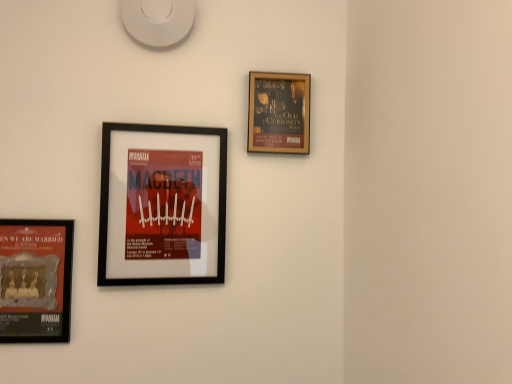
Image resolution: width=512 pixels, height=384 pixels. Describe the element at coordinates (35, 280) in the screenshot. I see `matte black poster at lower left, which is counted as the third picture frame, starting from the right` at that location.

Where is `black matte picture frame at center-left, placed as the second picture frame when sorted from left to right`? This screenshot has height=384, width=512. black matte picture frame at center-left, placed as the second picture frame when sorted from left to right is located at coordinates point(162,205).

From a real-world perspective, which object rests below the other?

In real-world perspective, matte black poster at lower left, which is the first picture frame from left to right, is lower.

Is black matte picture frame at center-left, placed as the second picture frame when sorted from left to right, positioned far away from matte black poster at lower left, which is counted as the third picture frame, starting from the right?

black matte picture frame at center-left, placed as the second picture frame when sorted from left to right, is actually quite close to matte black poster at lower left, which is counted as the third picture frame, starting from the right.

Is black matte picture frame at center-left, which is the 2th picture frame in right-to-left order, shorter than matte black poster at lower left, which is the first picture frame from left to right?

Incorrect, the height of black matte picture frame at center-left, which is the 2th picture frame in right-to-left order, does not fall short of that of matte black poster at lower left, which is the first picture frame from left to right.

Is gold-framed poster at upper right, which appears as the third picture frame when viewed from the left, turned away from matte black poster at lower left, which is the first picture frame from left to right?

gold-framed poster at upper right, which appears as the third picture frame when viewed from the left, is not turned away from matte black poster at lower left, which is the first picture frame from left to right.

Where is `picture frame that is the 2nd one when counting upward from the matte black poster at lower left, which is counted as the third picture frame, starting from the right (from the image's perspective)`? The width and height of the screenshot is (512, 384). picture frame that is the 2nd one when counting upward from the matte black poster at lower left, which is counted as the third picture frame, starting from the right (from the image's perspective) is located at coordinates (279, 113).

Which point is more forward, (283, 118) or (54, 275)?

The point (54, 275) is closer to the camera.

Is gold-framed poster at upper right, which appears as the third picture frame when viewed from the left, to the right of matte black poster at lower left, which is the first picture frame from left to right, from the viewer's perspective?

Indeed, gold-framed poster at upper right, which appears as the third picture frame when viewed from the left, is positioned on the right side of matte black poster at lower left, which is the first picture frame from left to right.

Can we say matte black poster at lower left, which is counted as the third picture frame, starting from the right, lies outside gold-framed poster at upper right, which appears as the first picture frame when viewed from the right?

Yes, matte black poster at lower left, which is counted as the third picture frame, starting from the right, is located beyond the bounds of gold-framed poster at upper right, which appears as the first picture frame when viewed from the right.

Which of these two, matte black poster at lower left, which is the first picture frame from left to right, or gold-framed poster at upper right, which appears as the third picture frame when viewed from the left, is thinner?

matte black poster at lower left, which is the first picture frame from left to right, is thinner.

Is matte black poster at lower left, which is counted as the third picture frame, starting from the right, positioned with its back to gold-framed poster at upper right, which appears as the third picture frame when viewed from the left?

matte black poster at lower left, which is counted as the third picture frame, starting from the right, is not turned away from gold-framed poster at upper right, which appears as the third picture frame when viewed from the left.

From the picture: Would you say matte black poster at lower left, which is counted as the third picture frame, starting from the right, is a long distance from gold-framed poster at upper right, which appears as the first picture frame when viewed from the right?

No, matte black poster at lower left, which is counted as the third picture frame, starting from the right, is in close proximity to gold-framed poster at upper right, which appears as the first picture frame when viewed from the right.

Is black matte picture frame at center-left, placed as the second picture frame when sorted from left to right, a part of matte black poster at lower left, which is the first picture frame from left to right?

No, black matte picture frame at center-left, placed as the second picture frame when sorted from left to right, is not a part of matte black poster at lower left, which is the first picture frame from left to right.

Based on the photo, from the image's perspective, which one is positioned lower, matte black poster at lower left, which is counted as the third picture frame, starting from the right, or black matte picture frame at center-left, which is the 2th picture frame in right-to-left order?

matte black poster at lower left, which is counted as the third picture frame, starting from the right, appears lower in the image.

The image size is (512, 384). In order to click on picture frame that is the 1st object to the right of the matte black poster at lower left, which is counted as the third picture frame, starting from the right, starting at the anchor in this screenshot , I will do `click(162, 205)`.

Is matte black poster at lower left, which is the first picture frame from left to right, facing away from black matte picture frame at center-left, placed as the second picture frame when sorted from left to right?

No, matte black poster at lower left, which is the first picture frame from left to right, is not facing away from black matte picture frame at center-left, placed as the second picture frame when sorted from left to right.

Is gold-framed poster at upper right, which appears as the first picture frame when viewed from the right, positioned before black matte picture frame at center-left, placed as the second picture frame when sorted from left to right?

No, gold-framed poster at upper right, which appears as the first picture frame when viewed from the right, is behind black matte picture frame at center-left, placed as the second picture frame when sorted from left to right.

From a real-world perspective, does gold-framed poster at upper right, which appears as the third picture frame when viewed from the left, sit lower than black matte picture frame at center-left, which is the 2th picture frame in right-to-left order?

Incorrect, from a real-world perspective, gold-framed poster at upper right, which appears as the third picture frame when viewed from the left, is higher than black matte picture frame at center-left, which is the 2th picture frame in right-to-left order.

Can you confirm if gold-framed poster at upper right, which appears as the third picture frame when viewed from the left, is bigger than black matte picture frame at center-left, placed as the second picture frame when sorted from left to right?

Actually, gold-framed poster at upper right, which appears as the third picture frame when viewed from the left, might be smaller than black matte picture frame at center-left, placed as the second picture frame when sorted from left to right.

Does gold-framed poster at upper right, which appears as the third picture frame when viewed from the left, turn towards black matte picture frame at center-left, placed as the second picture frame when sorted from left to right?

No, gold-framed poster at upper right, which appears as the third picture frame when viewed from the left, is not oriented towards black matte picture frame at center-left, placed as the second picture frame when sorted from left to right.

From a real-world perspective, which is physically below, black matte picture frame at center-left, placed as the second picture frame when sorted from left to right, or gold-framed poster at upper right, which appears as the third picture frame when viewed from the left?

From a 3D spatial view, black matte picture frame at center-left, placed as the second picture frame when sorted from left to right, is below.

Is black matte picture frame at center-left, placed as the second picture frame when sorted from left to right, completely or partially outside of gold-framed poster at upper right, which appears as the first picture frame when viewed from the right?

Yes.

Identify the location of picture frame above the black matte picture frame at center-left, which is the 2th picture frame in right-to-left order (from a real-world perspective). (279, 113).

Is black matte picture frame at center-left, placed as the second picture frame when sorted from left to right, positioned with its back to gold-framed poster at upper right, which appears as the first picture frame when viewed from the right?

black matte picture frame at center-left, placed as the second picture frame when sorted from left to right, is not turned away from gold-framed poster at upper right, which appears as the first picture frame when viewed from the right.

Find the location of a particular element. the 1st picture frame to the right of the matte black poster at lower left, which is counted as the third picture frame, starting from the right, starting your count from the anchor is located at coordinates tap(162, 205).

The width and height of the screenshot is (512, 384). Find the location of `picture frame that is the 2nd object to the left of the gold-framed poster at upper right, which appears as the third picture frame when viewed from the left, starting at the anchor`. picture frame that is the 2nd object to the left of the gold-framed poster at upper right, which appears as the third picture frame when viewed from the left, starting at the anchor is located at coordinates (35, 280).

Considering their positions, is black matte picture frame at center-left, placed as the second picture frame when sorted from left to right, positioned closer to gold-framed poster at upper right, which appears as the first picture frame when viewed from the right, than matte black poster at lower left, which is the first picture frame from left to right?

The object closer to gold-framed poster at upper right, which appears as the first picture frame when viewed from the right, is black matte picture frame at center-left, placed as the second picture frame when sorted from left to right.

Considering their positions, is gold-framed poster at upper right, which appears as the third picture frame when viewed from the left, positioned closer to matte black poster at lower left, which is counted as the third picture frame, starting from the right, than black matte picture frame at center-left, which is the 2th picture frame in right-to-left order?

Among the two, black matte picture frame at center-left, which is the 2th picture frame in right-to-left order, is located nearer to matte black poster at lower left, which is counted as the third picture frame, starting from the right.

Looking at the image, which one is located closer to gold-framed poster at upper right, which appears as the third picture frame when viewed from the left, matte black poster at lower left, which is counted as the third picture frame, starting from the right, or black matte picture frame at center-left, placed as the second picture frame when sorted from left to right?

Based on the image, black matte picture frame at center-left, placed as the second picture frame when sorted from left to right, appears to be nearer to gold-framed poster at upper right, which appears as the third picture frame when viewed from the left.

Looking at the image, which one is located closer to black matte picture frame at center-left, placed as the second picture frame when sorted from left to right, gold-framed poster at upper right, which appears as the third picture frame when viewed from the left, or matte black poster at lower left, which is the first picture frame from left to right?

matte black poster at lower left, which is the first picture frame from left to right.

Based on their spatial positions, is black matte picture frame at center-left, which is the 2th picture frame in right-to-left order, or gold-framed poster at upper right, which appears as the first picture frame when viewed from the right, further from matte black poster at lower left, which is counted as the third picture frame, starting from the right?

gold-framed poster at upper right, which appears as the first picture frame when viewed from the right, lies further to matte black poster at lower left, which is counted as the third picture frame, starting from the right, than the other object.

Consider the image. Which object lies nearer to the anchor point black matte picture frame at center-left, placed as the second picture frame when sorted from left to right, matte black poster at lower left, which is counted as the third picture frame, starting from the right, or gold-framed poster at upper right, which appears as the third picture frame when viewed from the left?

The object closer to black matte picture frame at center-left, placed as the second picture frame when sorted from left to right, is matte black poster at lower left, which is counted as the third picture frame, starting from the right.

Find the location of a particular element. The width and height of the screenshot is (512, 384). picture frame situated between matte black poster at lower left, which is counted as the third picture frame, starting from the right, and gold-framed poster at upper right, which appears as the third picture frame when viewed from the left, from left to right is located at coordinates (162, 205).